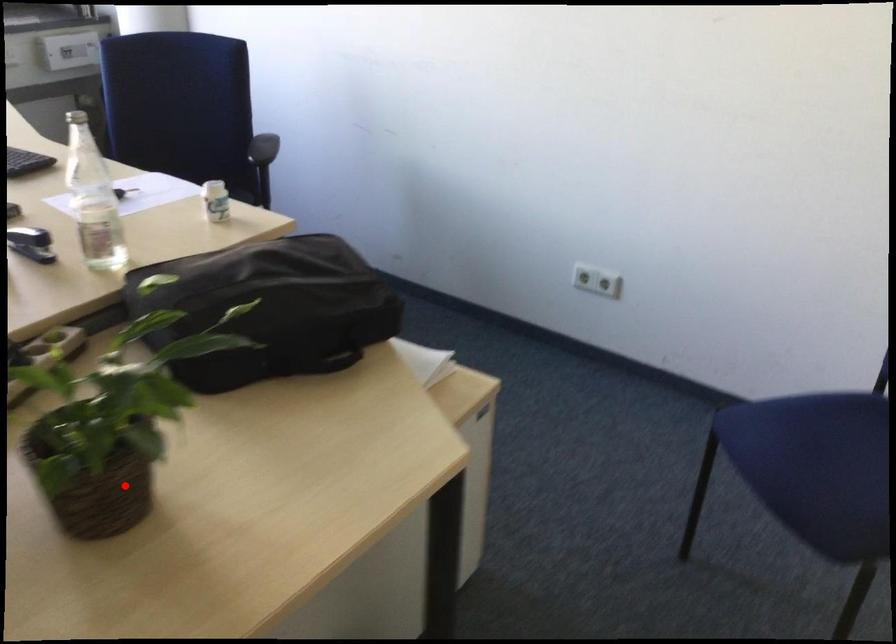
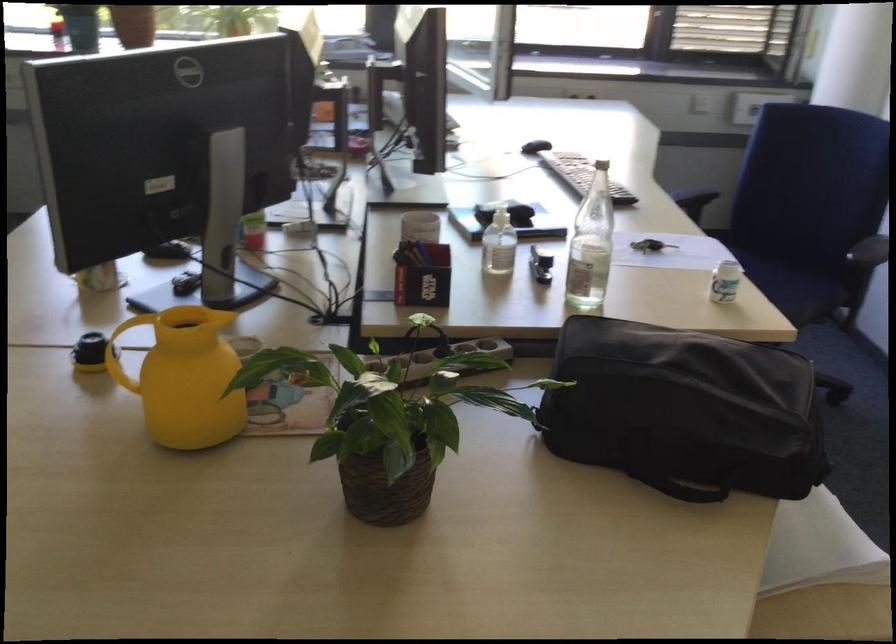
Find the pixel in the second image that matches the highlighted location in the first image.

(383, 484)